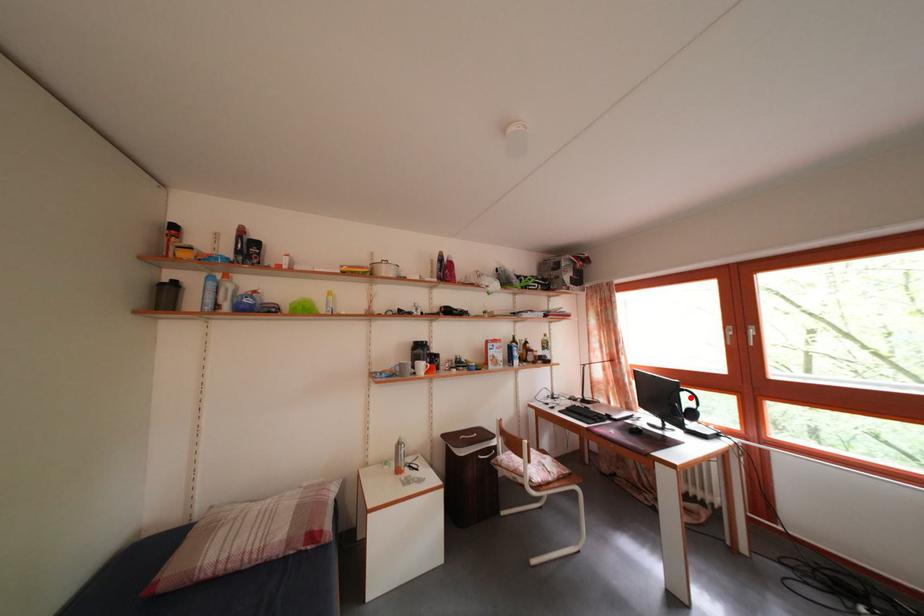
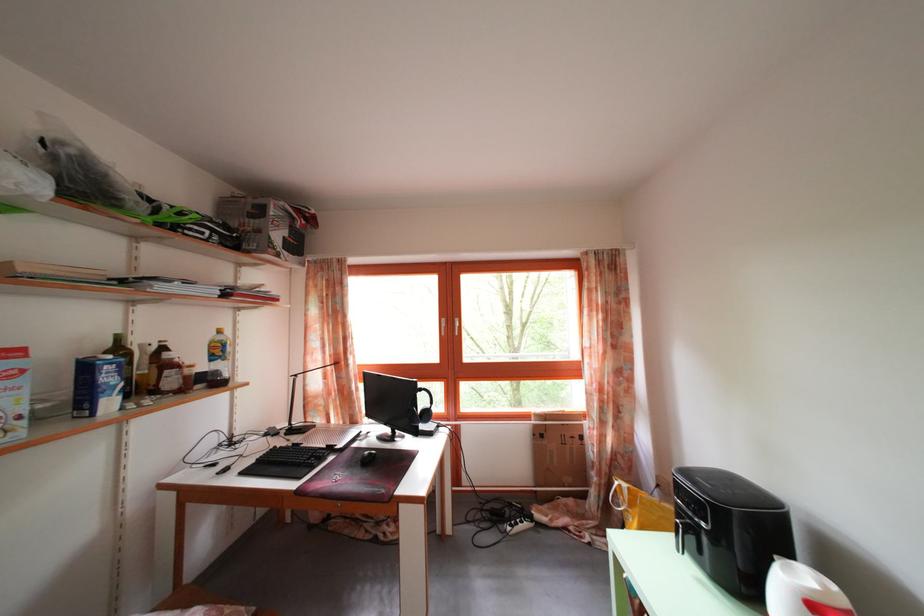
Question: I am providing you with two images of the same scene from different viewpoints. A red point is shown in image1. For the corresponding object point in image2, is it positioned nearer or farther from the camera?

Choices:
 (A) Nearer
 (B) Farther

Answer: (A)